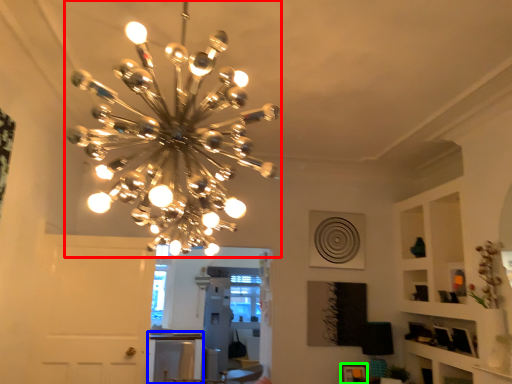
Question: Based on their relative distances, which object is farther from lamp (highlighted by a red box)? Choose from table (highlighted by a blue box) and picture frame (highlighted by a green box).

Choices:
 (A) table
 (B) picture frame

Answer: (A)